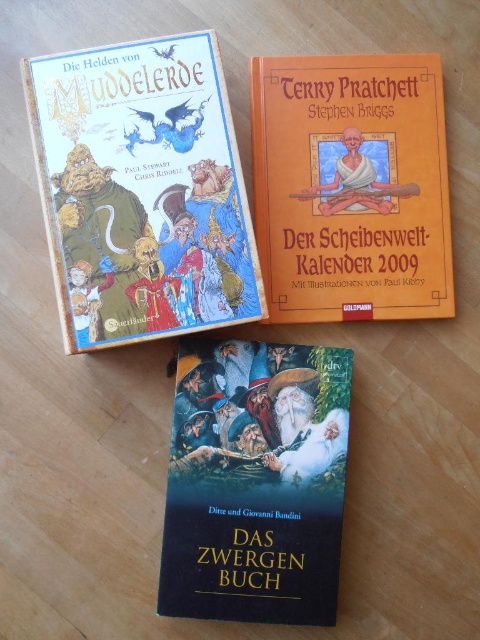
Who is lower down, matte paper book at upper left or brown leather book at upper center?

matte paper book at upper left is lower down.

Does matte paper book at upper left have a lesser width compared to brown leather book at upper center?

No.

Is point (168, 163) closer to viewer compared to point (266, 276)?

Yes.

At what (x,y) coordinates should I click in order to perform the action: click on matte paper book at upper left. Please return your answer as a coordinate pair (x, y). Image resolution: width=480 pixels, height=640 pixels. Looking at the image, I should click on (142, 189).

Does brown leather book at upper center have a greater width compared to dark blue matte book at center?

Indeed, brown leather book at upper center has a greater width compared to dark blue matte book at center.

Between point (407, 284) and point (271, 342), which one is positioned behind?

Positioned behind is point (407, 284).

What are the coordinates of `brown leather book at upper center` in the screenshot? It's located at (351, 186).

Identify the location of brown leather book at upper center. (351, 186).

Is point (205, 218) positioned behind point (182, 412)?

No.

Does matte paper book at upper left have a lesser width compared to dark blue matte book at center?

No, matte paper book at upper left is not thinner than dark blue matte book at center.

What are the coordinates of `matte paper book at upper left` in the screenshot? It's located at (142, 189).